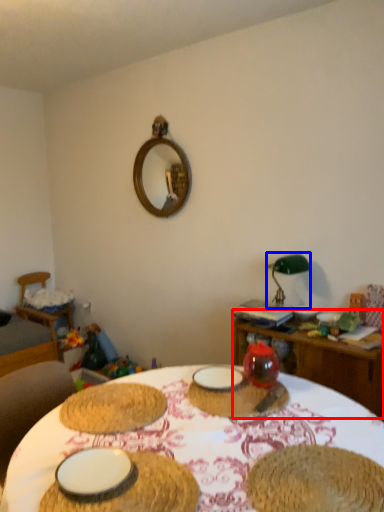
Question: Which object appears closest to the camera in this image, table (highlighted by a red box) or table lamp (highlighted by a blue box)?

Choices:
 (A) table
 (B) table lamp

Answer: (A)